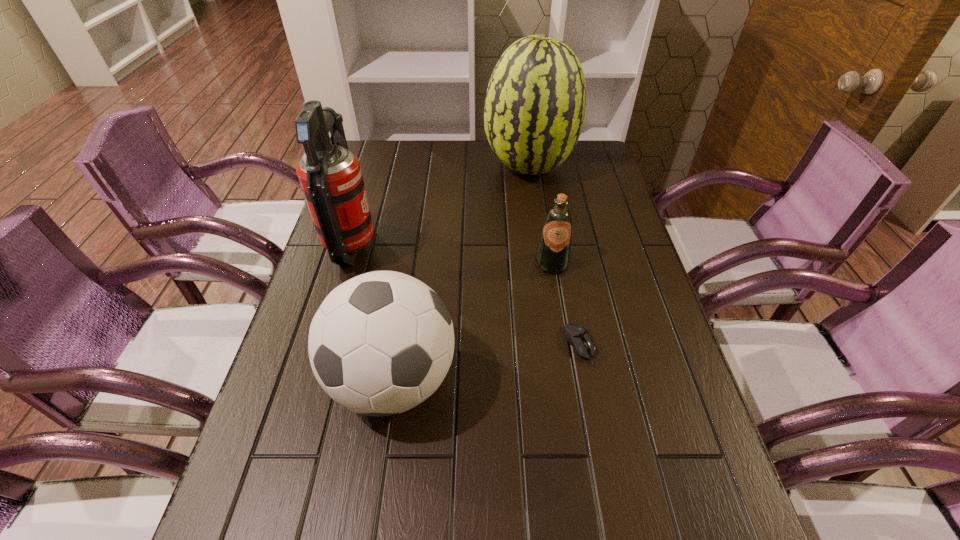
Image resolution: width=960 pixels, height=540 pixels. Identify the location of the farthest object. (534, 110).

This screenshot has height=540, width=960. I want to click on fire extinguisher, so click(x=330, y=175).

Identify the location of soccer ball. This screenshot has width=960, height=540. tap(381, 343).

Image resolution: width=960 pixels, height=540 pixels. In order to click on olive oil in this screenshot , I will do `click(553, 253)`.

You are a GUI agent. You are given a task and a screenshot of the screen. Output one action in this format:
    pyautogui.click(x=<x>, y=<y>)
    Task: Click on the computer mouse
    The width and height of the screenshot is (960, 540).
    Given the screenshot: What is the action you would take?
    pyautogui.click(x=578, y=337)

Where is `free space located 0.170m on the left of the farthest object`? free space located 0.170m on the left of the farthest object is located at coordinates (433, 168).

What are the coordinates of `vacant space positioned 0.300m on the front label side of the fire extinguisher` in the screenshot? It's located at (487, 246).

Where is `free space located on the right of the soccer ball`? This screenshot has height=540, width=960. free space located on the right of the soccer ball is located at coordinates (604, 380).

Identify the location of vacant space located 0.130m on the front-facing side of the fourth tallest object. (560, 315).

I want to click on vacant region located 0.370m on the left of the computer mouse, so point(401,345).